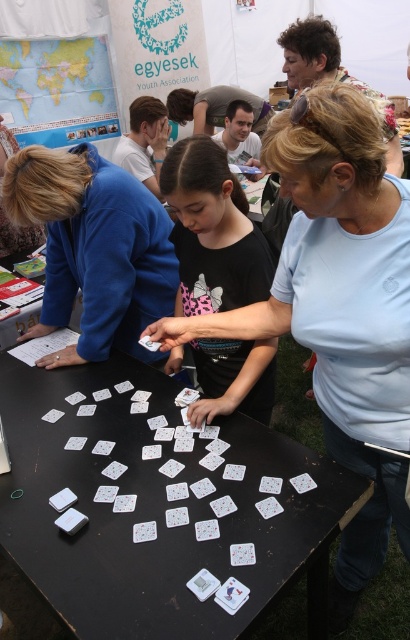
Who is lower down, light blue cotton shirt at center or black matte shirt at center?

light blue cotton shirt at center is lower down.

Is point (346, 385) positioned before point (186, 145)?

Yes, it is in front of point (186, 145).

Identify the location of light blue cotton shirt at center. pos(339,308).

Can you confirm if black plastic table at center is taller than light blue cotton shirt at center?

Incorrect, black plastic table at center's height is not larger of light blue cotton shirt at center's.

Can you confirm if black plastic table at center is wider than light blue cotton shirt at center?

Yes.

Between point (100, 621) and point (362, 380), which one is positioned behind?

Point (362, 380)

Locate an element on the screen. The width and height of the screenshot is (410, 640). black plastic table at center is located at coordinates (150, 508).

Is white paper cards at center below blue fabric jacket at upper left?

Yes, white paper cards at center is below blue fabric jacket at upper left.

Where is `white paper cards at center`? white paper cards at center is located at coordinates pyautogui.click(x=204, y=499).

You are a GUI agent. You are given a task and a screenshot of the screen. Output one action in this format:
    pyautogui.click(x=<x>, y=<y>)
    Task: Click on the white paper cards at center
    This screenshot has width=410, height=640.
    Given the screenshot: What is the action you would take?
    pyautogui.click(x=204, y=499)

This screenshot has height=640, width=410. In order to click on white paper cards at center in this screenshot , I will do point(204,499).